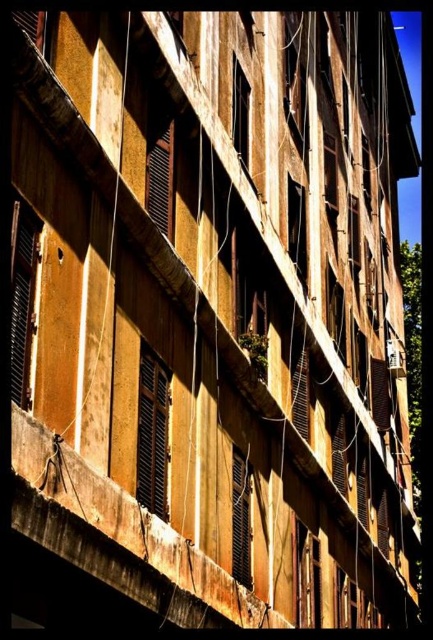
You are standing in front of the building and see the point at coordinates (152, 433). What object is this point located on?

The point at coordinates (152, 433) is located on the wooden shutters at center.

You are an electrician assessing the building facade. You see the wooden window frame at center and the matte brown window at center. Which object has a larger size?

The wooden window frame at center is bigger than the matte brown window at center according to the description.